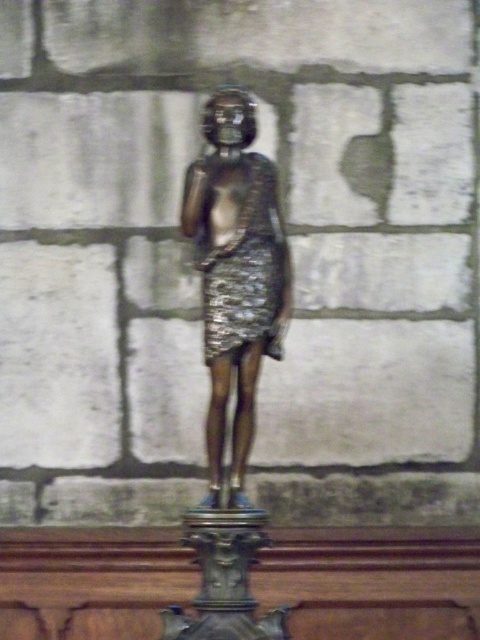
Question: Is shiny bronze statue at center bigger than shiny metallic dress at center?

Choices:
 (A) yes
 (B) no

Answer: (A)

Question: Which object appears closest to the camera in this image?

Choices:
 (A) shiny metallic dress at center
 (B) shiny bronze statue at center

Answer: (B)

Question: Is shiny bronze statue at center below shiny metallic dress at center?

Choices:
 (A) yes
 (B) no

Answer: (B)

Question: Is shiny bronze statue at center positioned at the back of shiny metallic dress at center?

Choices:
 (A) no
 (B) yes

Answer: (A)